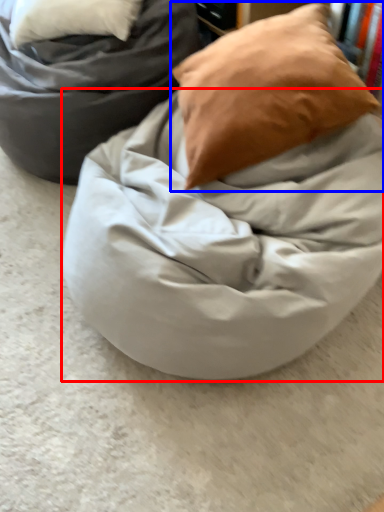
Question: Which object is further to the camera taking this photo, blanket (highlighted by a red box) or pillow (highlighted by a blue box)?

Choices:
 (A) blanket
 (B) pillow

Answer: (B)